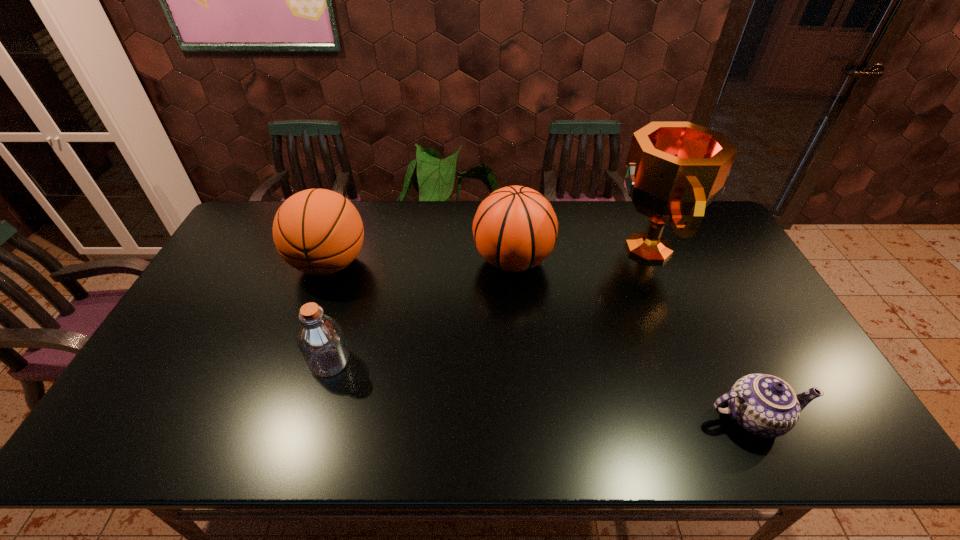
At what (x,y) coordinates should I click in order to perform the action: click on vacant region between the right basketball and the tallest object. Please return your answer as a coordinate pair (x, y). The height and width of the screenshot is (540, 960). Looking at the image, I should click on (580, 255).

I want to click on free spot between the third object from right to left and the award, so click(x=580, y=255).

Locate an element on the screen. This screenshot has width=960, height=540. vacant space that is in between the shortest object and the left basketball is located at coordinates (541, 341).

In order to click on vacant space that is in between the left basketball and the nearest object in this screenshot , I will do `click(541, 341)`.

Locate an element on the screen. This screenshot has height=540, width=960. vacant area that lies between the tallest object and the nearest object is located at coordinates (700, 333).

Identify which object is the second nearest to the third object from left to right. Please provide its 2D coordinates. Your answer should be formatted as a tuple, i.e. [(x, y)], where the tuple contains the x and y coordinates of a point satisfying the conditions above.

[(317, 231)]

Select which object appears as the second closest to the tallest object. Please provide its 2D coordinates. Your answer should be formatted as a tuple, i.e. [(x, y)], where the tuple contains the x and y coordinates of a point satisfying the conditions above.

[(765, 405)]

This screenshot has width=960, height=540. What are the coordinates of `free space that satisfies the following two spatial constraints: 1. on the front side of the bottle; 2. on the right side of the left basketball` in the screenshot? It's located at (294, 361).